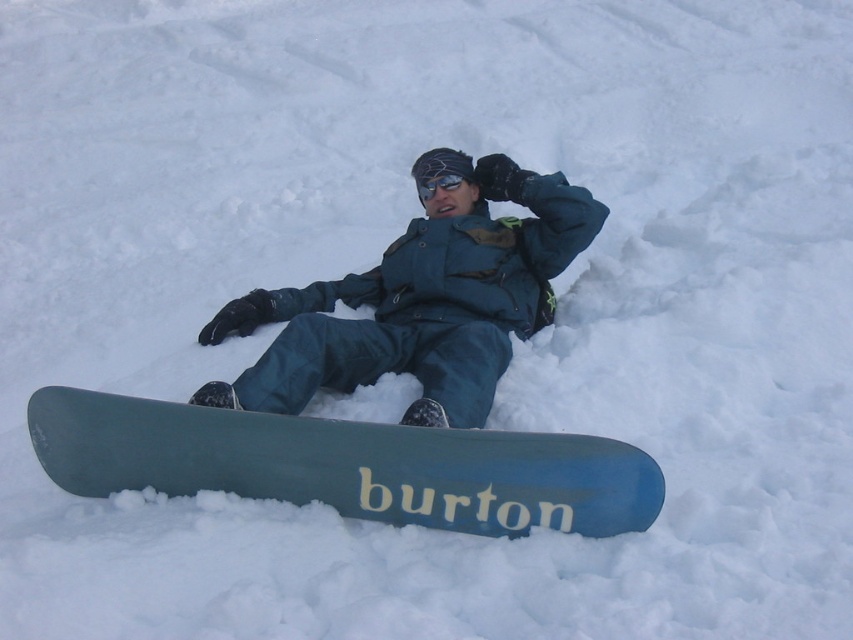
Question: Does blue matte snowboard at center lie in front of teal matte snowsuit at center?

Choices:
 (A) no
 (B) yes

Answer: (B)

Question: Is blue matte snowboard at center to the right of black reflective goggles at center from the viewer's perspective?

Choices:
 (A) yes
 (B) no

Answer: (B)

Question: Among these objects, which one is farthest from the camera?

Choices:
 (A) teal matte snowsuit at center
 (B) black reflective goggles at center
 (C) matte blue snowboard at center

Answer: (B)

Question: Which object appears closest to the camera in this image?

Choices:
 (A) blue matte snowboard at center
 (B) matte blue snowboard at center

Answer: (A)

Question: Does matte blue snowboard at center appear on the right side of teal matte snowsuit at center?

Choices:
 (A) yes
 (B) no

Answer: (B)

Question: Estimate the real-world distances between objects in this image. Which object is farther from the black reflective goggles at center?

Choices:
 (A) teal matte snowsuit at center
 (B) matte blue snowboard at center
 (C) blue matte snowboard at center

Answer: (C)